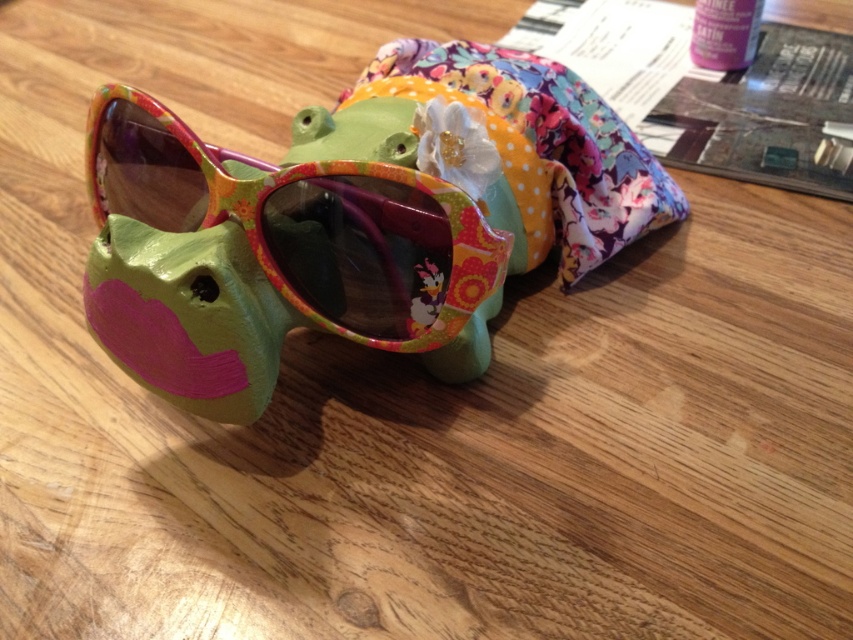
Question: Among these points, which one is nearest to the camera?

Choices:
 (A) (361, 276)
 (B) (577, 268)

Answer: (A)

Question: Is matte plastic goggles at center to the right of floral fabric pouch at center from the viewer's perspective?

Choices:
 (A) no
 (B) yes

Answer: (A)

Question: Can you confirm if matte plastic goggles at center is positioned above floral fabric pouch at center?

Choices:
 (A) no
 (B) yes

Answer: (A)

Question: Does matte plastic goggles at center appear on the right side of floral fabric pouch at center?

Choices:
 (A) yes
 (B) no

Answer: (B)

Question: Which point is closer to the camera taking this photo?

Choices:
 (A) (340, 264)
 (B) (485, 90)

Answer: (A)